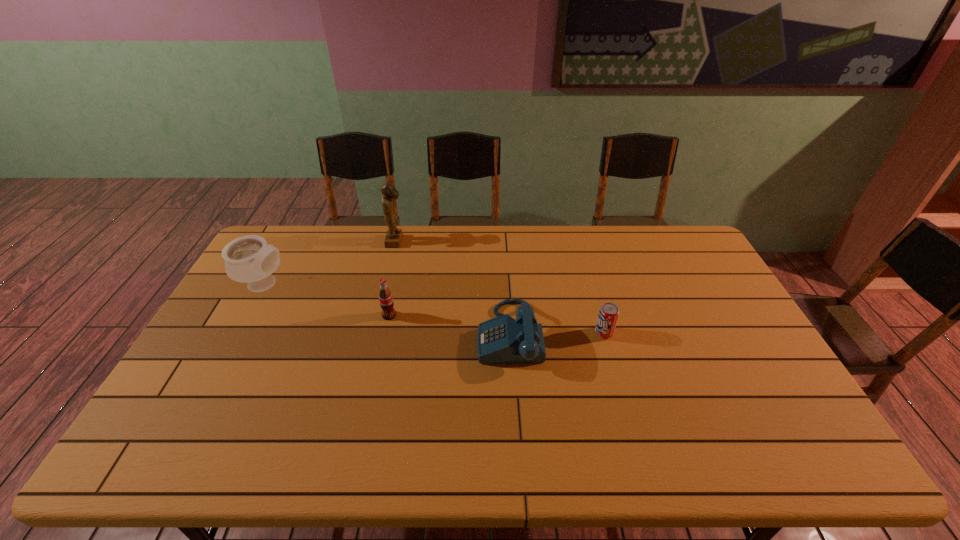
The image size is (960, 540). Find the location of `the tallest object`. the tallest object is located at coordinates point(394,236).

Locate an element on the screen. This screenshot has height=540, width=960. the farthest object is located at coordinates (394, 236).

Locate an element on the screen. The width and height of the screenshot is (960, 540). pottery is located at coordinates (249, 258).

In order to click on the leftmost object in this screenshot , I will do `click(249, 258)`.

Locate an element on the screen. The width and height of the screenshot is (960, 540). the third tallest object is located at coordinates (386, 301).

The height and width of the screenshot is (540, 960). In order to click on the taller soda can in this screenshot , I will do `click(386, 301)`.

Where is `telephone`? Image resolution: width=960 pixels, height=540 pixels. telephone is located at coordinates (502, 339).

Image resolution: width=960 pixels, height=540 pixels. Identify the location of the shorter soda can. (608, 315).

At what (x,y) coordinates should I click in order to perform the action: click on the rightmost object. Please return your answer as a coordinate pair (x, y). The image size is (960, 540). Looking at the image, I should click on (608, 315).

What are the coordinates of `vacant space located 0.350m on the front-facing side of the tallest object` in the screenshot? It's located at (498, 241).